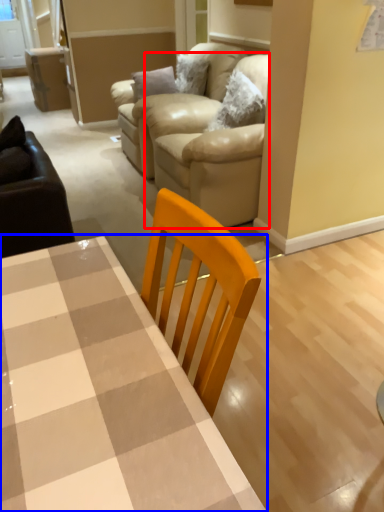
Question: Which object appears farthest to the camera in this image, couch (highlighted by a red box) or table (highlighted by a blue box)?

Choices:
 (A) couch
 (B) table

Answer: (A)